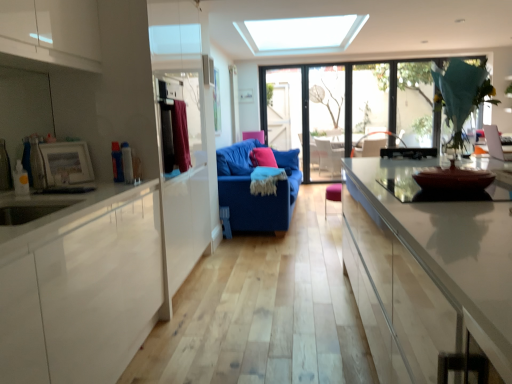
Question: Can you confirm if transparent glass window at upper right, the 2th window when ordered from left to right, is bigger than pink fabric armchair at center?

Choices:
 (A) yes
 (B) no

Answer: (A)

Question: Is transparent glass window at upper right, arranged as the first window when viewed from the right, outside pink fabric armchair at center?

Choices:
 (A) yes
 (B) no

Answer: (A)

Question: Is transparent glass window at upper right, the 2th window when ordered from left to right, closer to camera compared to pink fabric armchair at center?

Choices:
 (A) yes
 (B) no

Answer: (B)

Question: Does transparent glass window at upper right, the 2th window when ordered from left to right, come behind pink fabric armchair at center?

Choices:
 (A) no
 (B) yes

Answer: (B)

Question: Is transparent glass window at upper right, the 2th window when ordered from left to right, positioned far away from pink fabric armchair at center?

Choices:
 (A) no
 (B) yes

Answer: (B)

Question: Considering the positions of transparent glass window at upper right, arranged as the first window when viewed from the right, and velvet burgundy curtain at left in the image, is transparent glass window at upper right, arranged as the first window when viewed from the right, taller or shorter than velvet burgundy curtain at left?

Choices:
 (A) tall
 (B) short

Answer: (A)

Question: Considering the relative positions of transparent glass window at upper right, arranged as the first window when viewed from the right, and velvet burgundy curtain at left in the image provided, is transparent glass window at upper right, arranged as the first window when viewed from the right, to the left or to the right of velvet burgundy curtain at left?

Choices:
 (A) left
 (B) right

Answer: (B)

Question: Considering the positions of transparent glass window at upper right, arranged as the first window when viewed from the right, and velvet burgundy curtain at left in the image, is transparent glass window at upper right, arranged as the first window when viewed from the right, wider or thinner than velvet burgundy curtain at left?

Choices:
 (A) thin
 (B) wide

Answer: (B)

Question: In terms of size, does transparent glass window at upper right, the 2th window when ordered from left to right, appear bigger or smaller than velvet burgundy curtain at left?

Choices:
 (A) big
 (B) small

Answer: (A)

Question: From a real-world perspective, is blue fabric couch at center physically located above or below velvet burgundy curtain at left?

Choices:
 (A) below
 (B) above

Answer: (A)

Question: Looking at the image, does blue fabric couch at center seem bigger or smaller compared to velvet burgundy curtain at left?

Choices:
 (A) big
 (B) small

Answer: (A)

Question: Is blue fabric couch at center in front of or behind velvet burgundy curtain at left in the image?

Choices:
 (A) behind
 (B) front

Answer: (A)

Question: Looking at their shapes, would you say blue fabric couch at center is wider or thinner than velvet burgundy curtain at left?

Choices:
 (A) wide
 (B) thin

Answer: (A)

Question: Is transparent glass window at upper right, the 2th window when ordered from left to right, to the left or to the right of transparent glass door at center in the image?

Choices:
 (A) left
 (B) right

Answer: (B)

Question: In terms of height, does transparent glass window at upper right, the 2th window when ordered from left to right, look taller or shorter compared to transparent glass door at center?

Choices:
 (A) short
 (B) tall

Answer: (A)